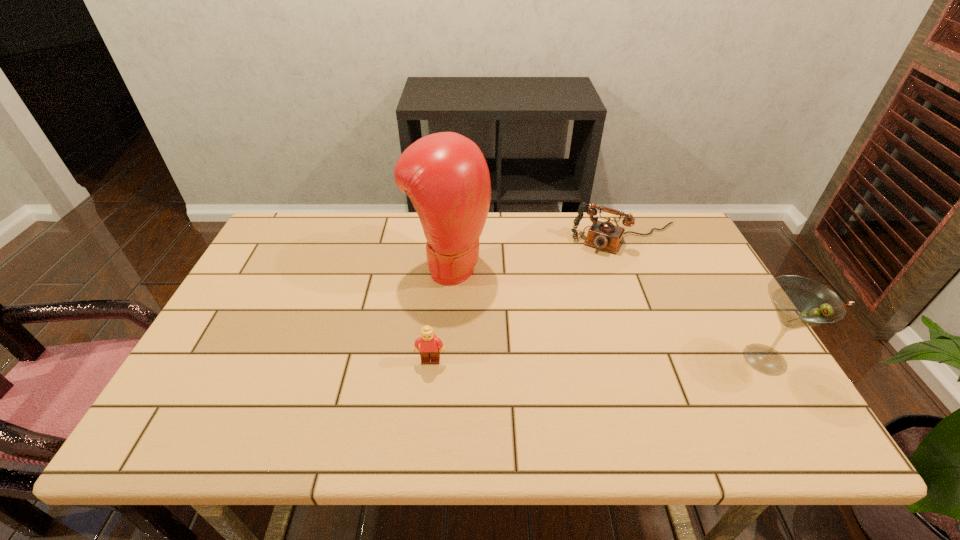
Where is `vacant position located on the dial of the telephone`? This screenshot has height=540, width=960. vacant position located on the dial of the telephone is located at coordinates (595, 270).

You are a GUI agent. You are given a task and a screenshot of the screen. Output one action in this format:
    pyautogui.click(x=<x>, y=<y>)
    Task: Click on the vacant area situated on the dial of the telephone
    The width and height of the screenshot is (960, 540).
    Given the screenshot: What is the action you would take?
    pyautogui.click(x=580, y=298)

Where is `boxing glove that is at the far edge`? This screenshot has width=960, height=540. boxing glove that is at the far edge is located at coordinates (445, 175).

Locate an element on the screen. The height and width of the screenshot is (540, 960). telephone located at the far edge is located at coordinates (605, 235).

This screenshot has height=540, width=960. I want to click on object situated at the near edge, so click(800, 302).

Find the location of a particular element. martini that is at the right edge is located at coordinates (800, 302).

Where is `telephone that is at the right edge`? This screenshot has height=540, width=960. telephone that is at the right edge is located at coordinates (605, 235).

Where is `object located at the far right corner`? The image size is (960, 540). object located at the far right corner is located at coordinates (605, 235).

Locate an element on the screen. Image resolution: width=960 pixels, height=540 pixels. object that is at the near right corner is located at coordinates (800, 302).

The height and width of the screenshot is (540, 960). In order to click on free space at the far edge of the desktop in this screenshot , I will do click(397, 238).